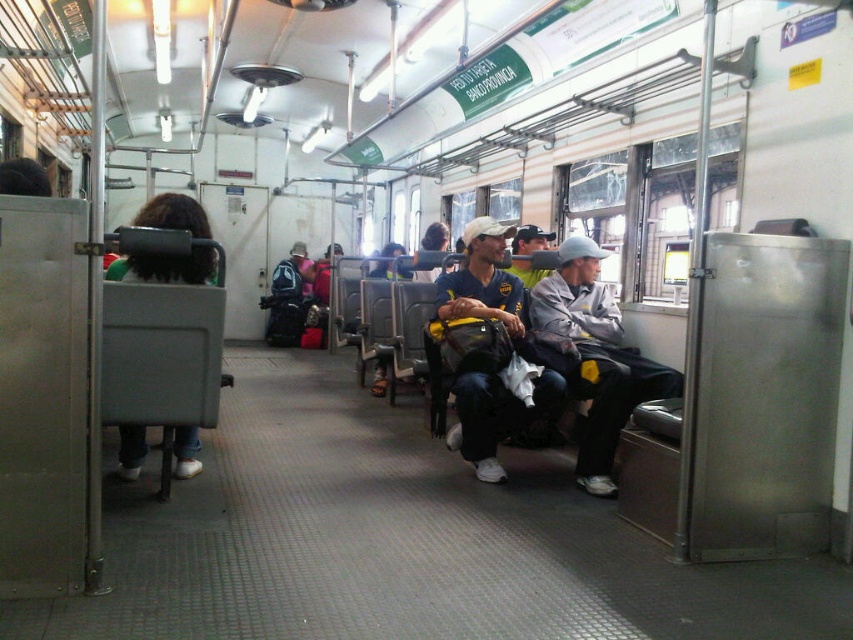
Question: Based on their relative distances, which object is nearer to the green fabric backpack at left?

Choices:
 (A) matte blue shirt at center
 (B) gray fabric jacket at center

Answer: (A)

Question: Is gray fabric jacket at center below matte blue shirt at center?

Choices:
 (A) yes
 (B) no

Answer: (A)

Question: Which object is closer to the camera taking this photo?

Choices:
 (A) matte blue shirt at center
 (B) green fabric backpack at left
 (C) gray fabric jacket at center

Answer: (B)

Question: Does matte blue shirt at center have a greater width compared to green fabric backpack at left?

Choices:
 (A) no
 (B) yes

Answer: (A)

Question: Estimate the real-world distances between objects in this image. Which object is farther from the green fabric backpack at left?

Choices:
 (A) matte blue shirt at center
 (B) gray fabric jacket at center
 (C) matte blue cap at center

Answer: (C)

Question: Is gray fabric jacket at center bigger than matte blue cap at center?

Choices:
 (A) no
 (B) yes

Answer: (B)